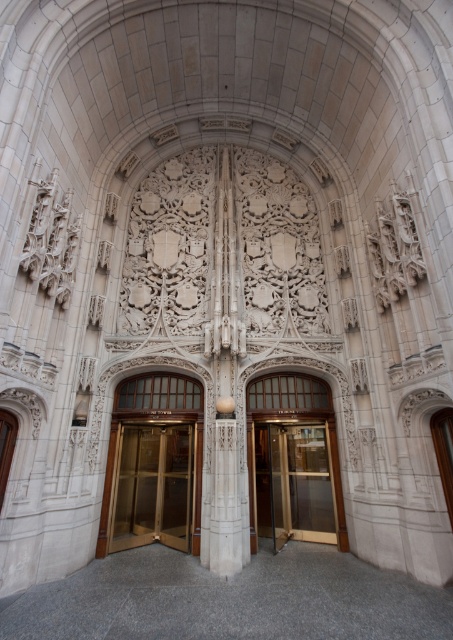
Question: Considering the relative positions of gold/glass elevator at center and gold/glass elevator doors at center in the image provided, where is gold/glass elevator at center located with respect to gold/glass elevator doors at center?

Choices:
 (A) right
 (B) left

Answer: (A)

Question: Which object appears farthest from the camera in this image?

Choices:
 (A) gold/glass elevator doors at center
 (B) gold/glass elevator at center

Answer: (B)

Question: Is gold/glass elevator at center above gold/glass elevator doors at center?

Choices:
 (A) yes
 (B) no

Answer: (B)

Question: Does gold/glass elevator at center have a lesser width compared to gold/glass elevator doors at center?

Choices:
 (A) no
 (B) yes

Answer: (B)

Question: Which point is closer to the camera taking this photo?

Choices:
 (A) coord(168,458)
 (B) coord(283,506)

Answer: (B)

Question: Which of the following is the farthest from the observer?

Choices:
 (A) (331, 513)
 (B) (220, 528)
 (C) (117, 522)

Answer: (A)